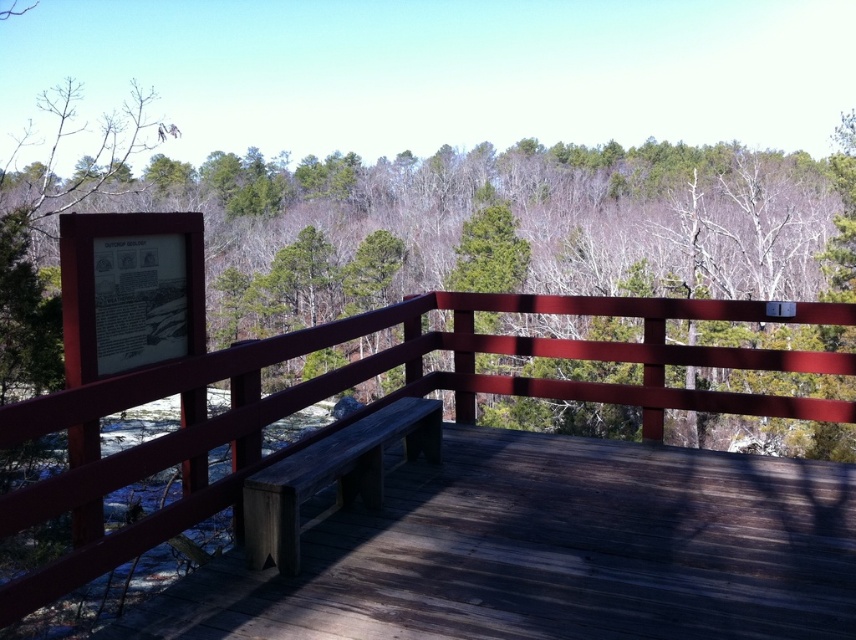
Is point (366, 268) closer to viewer compared to point (444, 308)?

No, (366, 268) is further to viewer.

Which is more to the right, green matte sign at upper left or wooden bench at center?

green matte sign at upper left is more to the right.

You are a GUI agent. You are given a task and a screenshot of the screen. Output one action in this format:
    pyautogui.click(x=<x>, y=<y>)
    Task: Click on the green matte sign at upper left
    This screenshot has width=856, height=640.
    Given the screenshot: What is the action you would take?
    pyautogui.click(x=544, y=237)